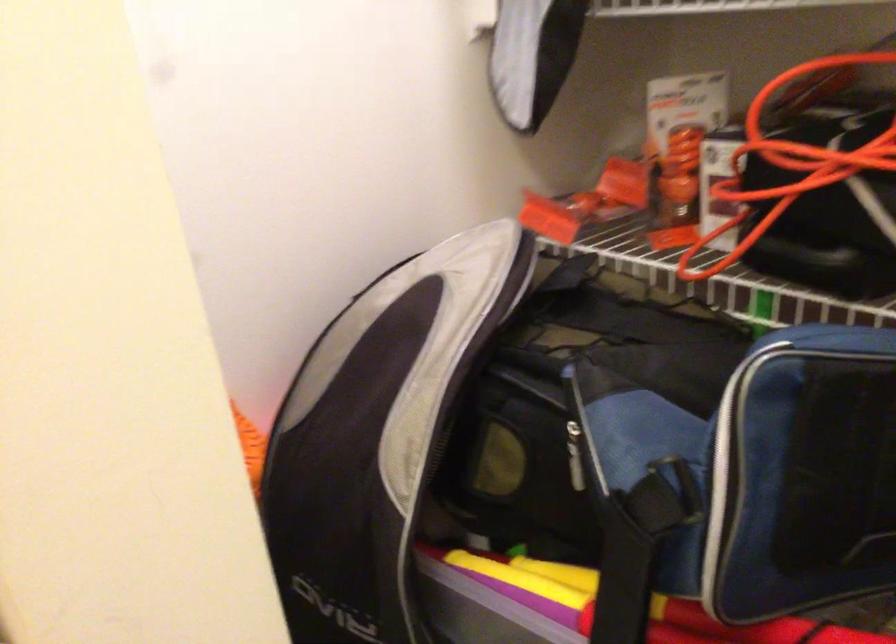
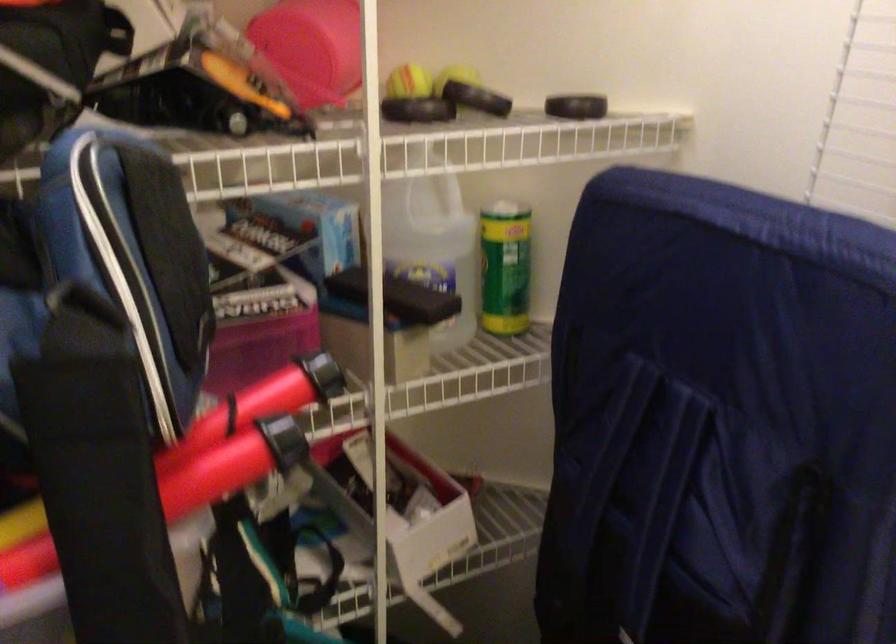
Question: The camera is either moving clockwise (left) or counter-clockwise (right) around the object. The first image is from the beginning of the video and the second image is from the end. Is the camera moving left or right when shooting the video?

Choices:
 (A) Left
 (B) Right

Answer: (A)